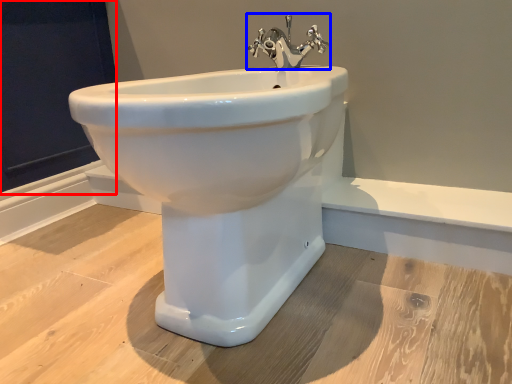
Question: Which object appears closest to the camera in this image, screen door (highlighted by a red box) or tap (highlighted by a blue box)?

Choices:
 (A) screen door
 (B) tap

Answer: (B)